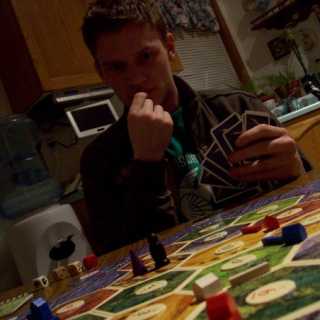
Identify the location of board. This screenshot has height=320, width=320. coord(286,198).